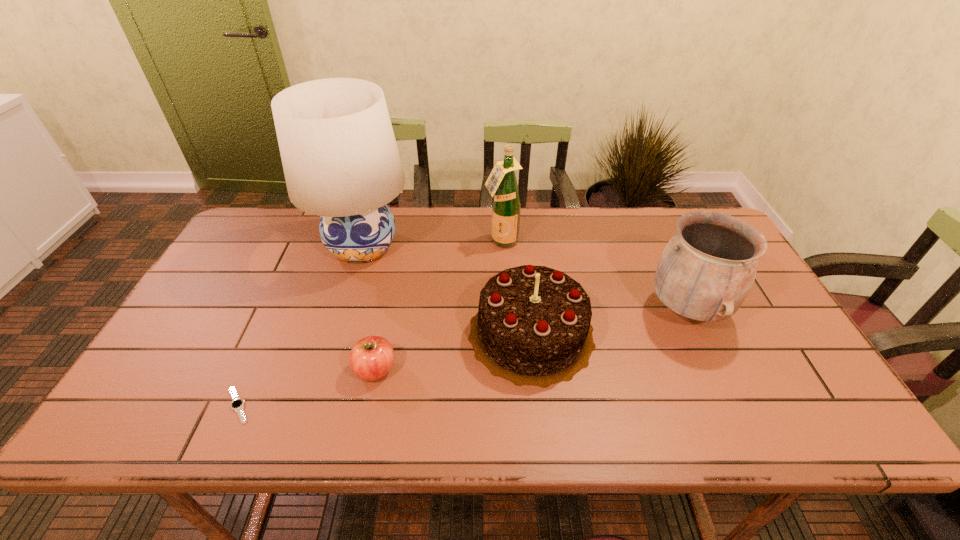
In order to click on free space between the shortest object and the fifth tallest object in this screenshot , I will do `click(306, 388)`.

Locate which object ranks fourth in proximity to the fourth shortest object. Please provide its 2D coordinates. Your answer should be formatted as a tuple, i.e. [(x, y)], where the tuple contains the x and y coordinates of a point satisfying the conditions above.

[(340, 159)]

Image resolution: width=960 pixels, height=540 pixels. What are the coordinates of `object that is the fourth closest to the rightmost object` in the screenshot? It's located at (340, 159).

You are a GUI agent. You are given a task and a screenshot of the screen. Output one action in this format:
    pyautogui.click(x=<x>, y=<y>)
    Task: Click on the free space that satisfies the following two spatial constraints: 1. on the front-facing side of the fourth tallest object; 2. on the right side of the tallest object
    
    Given the screenshot: What is the action you would take?
    pyautogui.click(x=336, y=333)

Identify the location of vacant position in the image that satisfies the following two spatial constraints: 1. on the front-facing side of the tallest object; 2. on the right side of the apple. The width and height of the screenshot is (960, 540). (324, 370).

Where is `free space that satisfies the following two spatial constraints: 1. on the front-facing side of the tallest object; 2. on the left side of the rightmost object`? The height and width of the screenshot is (540, 960). free space that satisfies the following two spatial constraints: 1. on the front-facing side of the tallest object; 2. on the left side of the rightmost object is located at coordinates (343, 309).

Locate an element on the screen. The width and height of the screenshot is (960, 540). vacant area in the image that satisfies the following two spatial constraints: 1. on the front-facing side of the fourth tallest object; 2. on the left side of the lampshade is located at coordinates (336, 333).

Image resolution: width=960 pixels, height=540 pixels. In order to click on vacant area that satisfies the following two spatial constraints: 1. on the front-facing side of the lampshade; 2. on the left side of the birthday cake in this screenshot , I will do `click(336, 333)`.

Where is `vacant position in the image that satisfies the following two spatial constraints: 1. on the front-facing side of the rightmost object; 2. on the right side of the lampshade`? Image resolution: width=960 pixels, height=540 pixels. vacant position in the image that satisfies the following two spatial constraints: 1. on the front-facing side of the rightmost object; 2. on the right side of the lampshade is located at coordinates (343, 309).

Identify the location of blank area in the image that satisfies the following two spatial constraints: 1. on the back side of the fifth tallest object; 2. on the left side of the watch. The image size is (960, 540). pos(254,370).